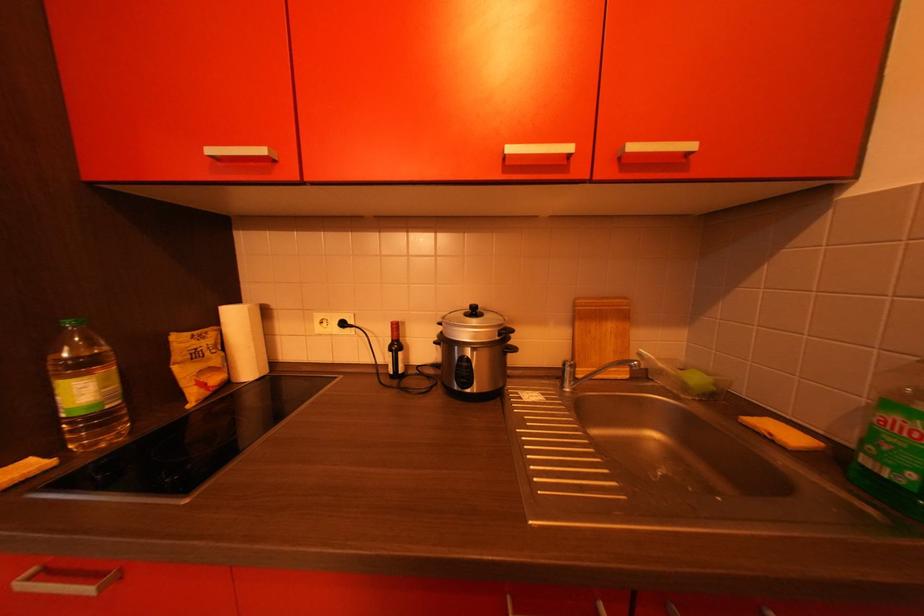
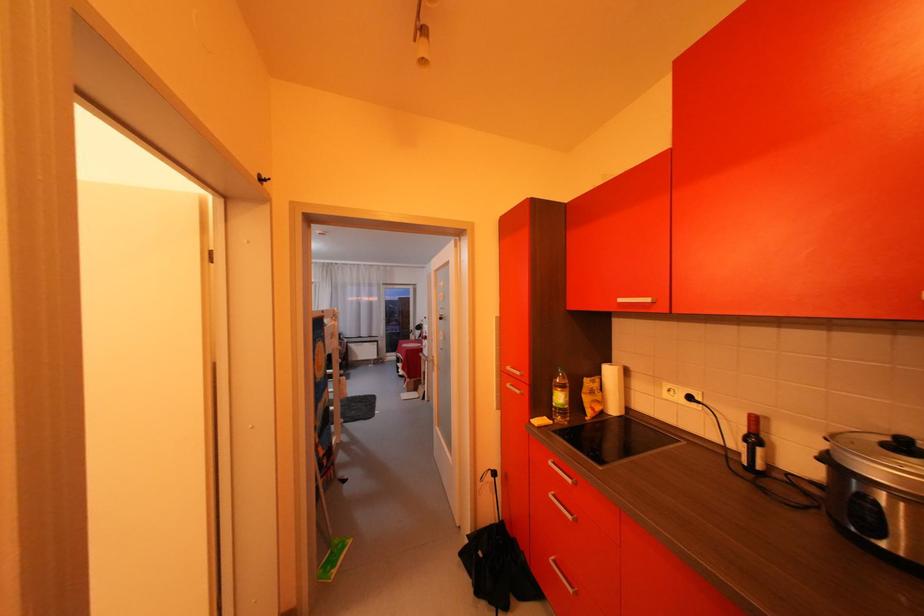
Question: The first image is from the beginning of the video and the second image is from the end. How did the camera likely rotate when shooting the video?

Choices:
 (A) Left
 (B) Right
 (C) Up
 (D) Down

Answer: (A)